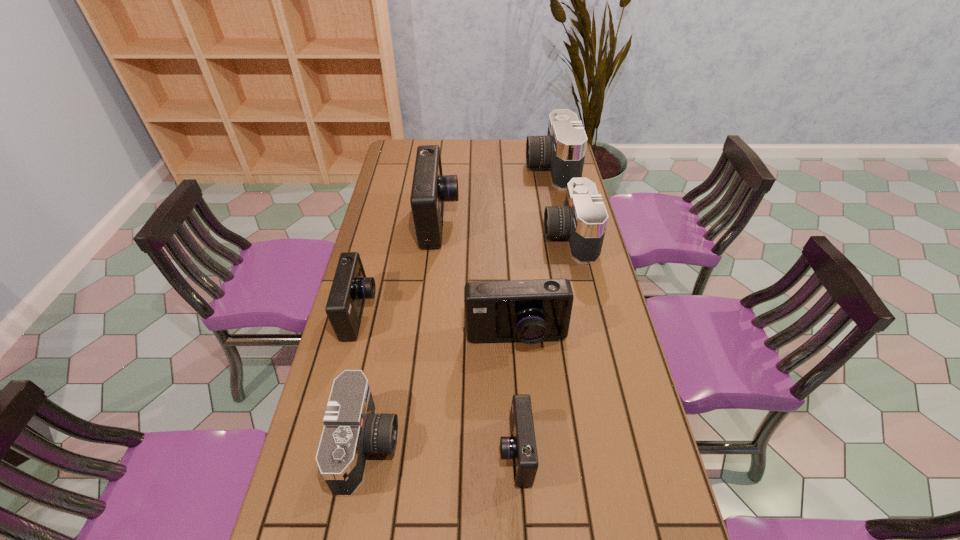
This screenshot has height=540, width=960. Identify the location of free area in between the leftmost black camera and the smallest blue camera. (442, 448).

Locate an element on the screen. The height and width of the screenshot is (540, 960). free space between the leftmost black camera and the nearest blue camera is located at coordinates (442, 448).

You are a GUI agent. You are given a task and a screenshot of the screen. Output one action in this format:
    pyautogui.click(x=<x>, y=<y>)
    Task: Click on the free space between the third blue camera from right to left and the third biggest blue camera
    
    Given the screenshot: What is the action you would take?
    pyautogui.click(x=399, y=267)

Find the location of a particular element. vacant space that's between the biggest blue camera and the second smallest black camera is located at coordinates (504, 229).

Select which object appears as the closest to the second biggest blue camera. Please provide its 2D coordinates. Your answer should be formatted as a tuple, i.e. [(x, y)], where the tuple contains the x and y coordinates of a point satisfying the conditions above.

[(521, 446)]

Where is `object that is the closest to the leftmost black camera`? object that is the closest to the leftmost black camera is located at coordinates (350, 287).

This screenshot has width=960, height=540. Find the location of `camera that can be found as the closest to the shortest object`. camera that can be found as the closest to the shortest object is located at coordinates (531, 311).

Identify which camera is located as the nearest to the leftmost blue camera. Please provide its 2D coordinates. Your answer should be formatted as a tuple, i.e. [(x, y)], where the tuple contains the x and y coordinates of a point satisfying the conditions above.

[(352, 429)]

The height and width of the screenshot is (540, 960). In order to click on blue camera object that ranks as the closest to the second biggest blue camera in this screenshot , I will do `click(521, 446)`.

This screenshot has height=540, width=960. I want to click on blue camera that stands as the third closest to the second biggest blue camera, so click(430, 189).